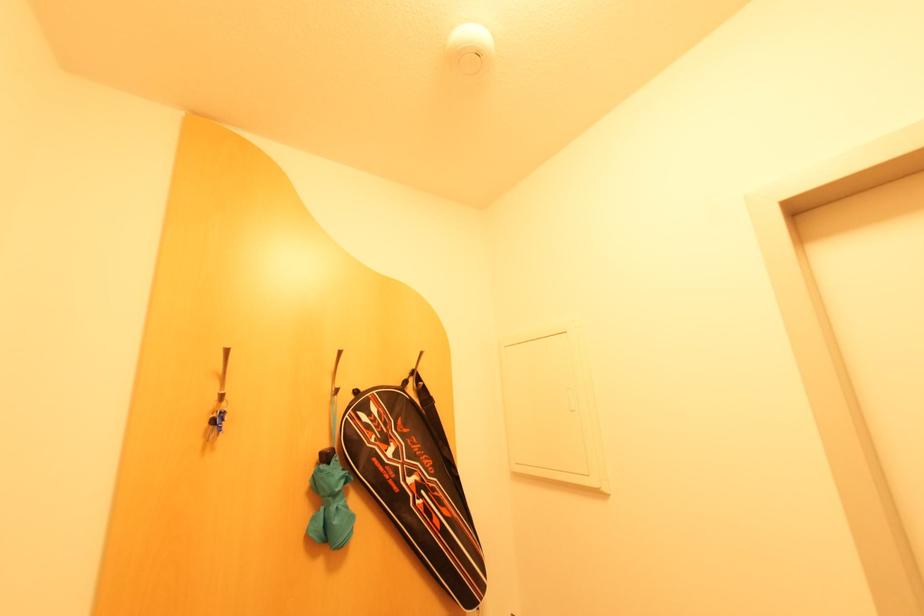
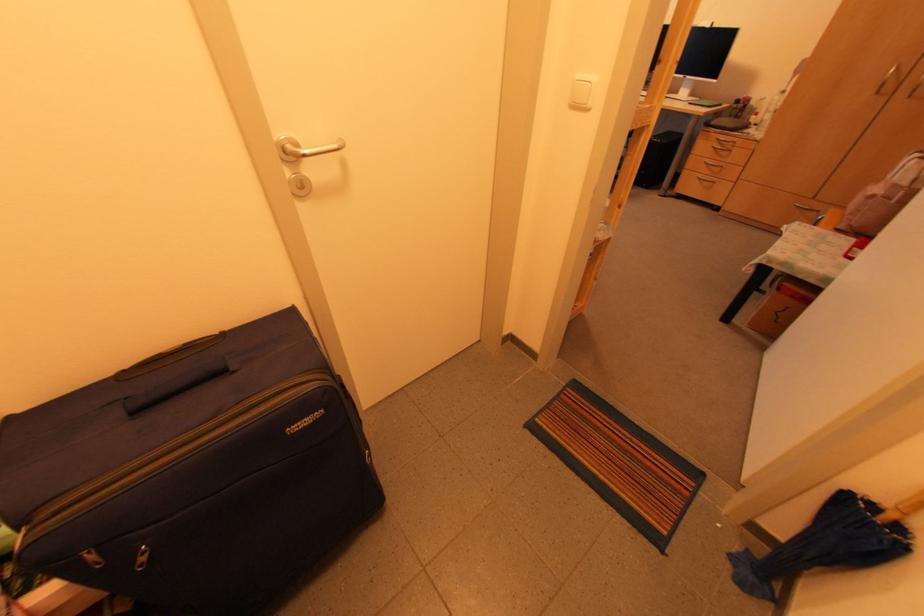
How did the camera likely rotate?

The rotation direction of the camera is right-down.